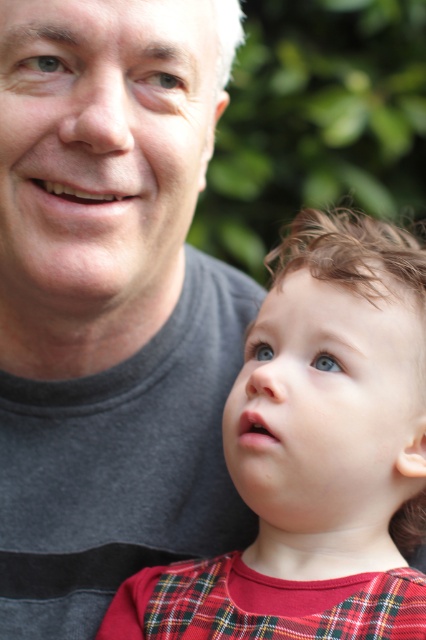
Question: Does gray matte t-shirt at upper left appear on the right side of red plaid shirt at center?

Choices:
 (A) no
 (B) yes

Answer: (A)

Question: Can you confirm if gray matte t-shirt at upper left is positioned to the left of red plaid shirt at center?

Choices:
 (A) no
 (B) yes

Answer: (B)

Question: Among these points, which one is nearest to the camera?

Choices:
 (A) (218, 604)
 (B) (207, 336)

Answer: (A)

Question: Which point is farther to the camera?

Choices:
 (A) (411, 358)
 (B) (173, 502)

Answer: (B)

Question: Can you confirm if gray matte t-shirt at upper left is thinner than red plaid shirt at center?

Choices:
 (A) no
 (B) yes

Answer: (B)

Question: Which point is farther to the camera?

Choices:
 (A) red plaid shirt at center
 (B) gray matte t-shirt at upper left

Answer: (A)